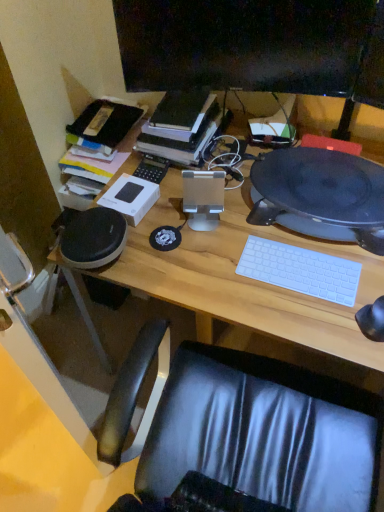
This screenshot has width=384, height=512. What do you see at coordinates (244, 44) in the screenshot?
I see `black glossy monitor at upper center` at bounding box center [244, 44].

The image size is (384, 512). What do you see at coordinates (320, 195) in the screenshot? I see `black matte speaker at right` at bounding box center [320, 195].

Where is `wooden desk at center`? wooden desk at center is located at coordinates pyautogui.click(x=244, y=279).

In order to click on hardcover book at center in this screenshot , I will do (x=181, y=126).

Which of these two, black matte speaker at right or hardcover book at center, is bigger?

Bigger between the two is black matte speaker at right.

Would you say black matte speaker at right contains hardcover book at center?

No, hardcover book at center is not a part of black matte speaker at right.

Which is in front, black matte speaker at right or hardcover book at center?

black matte speaker at right is in front.

From a real-world perspective, is black matte speaker at right located higher than hardcover book at center?

No, from a real-world perspective, black matte speaker at right is not above hardcover book at center.

In terms of width, does white matte keyboard at center look wider or thinner when compared to black glossy monitor at upper center?

white matte keyboard at center is wider than black glossy monitor at upper center.

Choose the correct answer: Is white matte keyboard at center inside black glossy monitor at upper center or outside it?

white matte keyboard at center is not enclosed by black glossy monitor at upper center.

Which is closer, [337,283] or [259,29]?

The point [337,283] is in front.

From their relative heights in the image, would you say white matte keyboard at center is taller or shorter than black glossy monitor at upper center?

Considering their sizes, white matte keyboard at center has less height than black glossy monitor at upper center.

Is hardcover book at center at the left side of white matte keyboard at center?

Correct, you'll find hardcover book at center to the left of white matte keyboard at center.

Considering the sizes of hardcover book at center and white matte keyboard at center in the image, is hardcover book at center bigger or smaller than white matte keyboard at center?

hardcover book at center is bigger than white matte keyboard at center.

Which object is closer to the camera taking this photo, hardcover book at center or white matte keyboard at center?

white matte keyboard at center is in front.

Is hardcover book at center facing towards white matte keyboard at center?

A: No.

Is black glossy monitor at upper center behind wooden desk at center?

Yes, it is behind wooden desk at center.

Based on the photo, from the image's perspective, relative to wooden desk at center, is black glossy monitor at upper center above or below?

Clearly, from the image's perspective, black glossy monitor at upper center is above wooden desk at center.

Is black glossy monitor at upper center facing towards wooden desk at center?

No, black glossy monitor at upper center is not aimed at wooden desk at center.

Considering the sizes of objects black glossy monitor at upper center and wooden desk at center in the image provided, who is bigger, black glossy monitor at upper center or wooden desk at center?

Bigger between the two is wooden desk at center.

Is hardcover book at center completely or partially outside of wooden desk at center?

Indeed, hardcover book at center is completely outside wooden desk at center.

Is point (169, 139) closer or farther from the camera than point (130, 275)?

Point (169, 139) appears to be farther away from the viewer than point (130, 275).

Is hardcover book at center facing towards wooden desk at center?

No, hardcover book at center is not facing towards wooden desk at center.

Between hardcover book at center and wooden desk at center, which one has more height?

With more height is wooden desk at center.

Consider the image. How many degrees apart are the facing directions of black matte speaker at right and black glossy monitor at upper center?

21.8 degrees.

Considering the sizes of black matte speaker at right and black glossy monitor at upper center in the image, is black matte speaker at right taller or shorter than black glossy monitor at upper center?

black matte speaker at right is shorter than black glossy monitor at upper center.

From the image's perspective, is black matte speaker at right located above black glossy monitor at upper center?

Incorrect, from the image's perspective, black matte speaker at right is lower than black glossy monitor at upper center.

Which of these two, black matte speaker at right or black glossy monitor at upper center, is wider?

black matte speaker at right is wider.

Is hardcover book at center positioned with its back to black matte speaker at right?

That's not correct — hardcover book at center is not looking away from black matte speaker at right.

Is hardcover book at center taller or shorter than black matte speaker at right?

Clearly, hardcover book at center is taller compared to black matte speaker at right.

Considering the sizes of hardcover book at center and black matte speaker at right in the image, is hardcover book at center bigger or smaller than black matte speaker at right?

Clearly, hardcover book at center is smaller in size than black matte speaker at right.

Is hardcover book at center not inside black matte speaker at right?

hardcover book at center is positioned outside black matte speaker at right.

Identify the location of book behind the black matte speaker at right. The width and height of the screenshot is (384, 512). (181, 126).

Where is `computer keyboard that appears on the right of black glossy monitor at upper center`? This screenshot has width=384, height=512. computer keyboard that appears on the right of black glossy monitor at upper center is located at coordinates (300, 270).

Looking at the image, which one is located further to wooden desk at center, black matte speaker at right or white matte keyboard at center?

black matte speaker at right is further to wooden desk at center.

Which object lies further to the anchor point white matte keyboard at center, hardcover book at center or wooden desk at center?

Among the two, hardcover book at center is located further to white matte keyboard at center.

When comparing their distances from black matte speaker at right, does wooden desk at center or hardcover book at center seem further?

Among the two, hardcover book at center is located further to black matte speaker at right.

Based on their spatial positions, is black glossy monitor at upper center or wooden desk at center closer to black matte speaker at right?

Based on the image, wooden desk at center appears to be nearer to black matte speaker at right.

Estimate the real-world distances between objects in this image. Which object is closer to wooden desk at center, hardcover book at center or black matte speaker at right?

Among the two, black matte speaker at right is located nearer to wooden desk at center.

Considering their positions, is black glossy monitor at upper center positioned closer to wooden desk at center than white matte keyboard at center?

white matte keyboard at center lies closer to wooden desk at center than the other object.

From the image, which object appears to be nearer to black glossy monitor at upper center, black matte speaker at right or wooden desk at center?

Among the two, black matte speaker at right is located nearer to black glossy monitor at upper center.

Considering their positions, is wooden desk at center positioned further to white matte keyboard at center than black glossy monitor at upper center?

black glossy monitor at upper center is positioned further to the anchor white matte keyboard at center.

At what (x,y) coordinates should I click in order to perform the action: click on computer between black glossy monitor at upper center and white matte keyboard at center vertically. Please return your answer as a coordinate pair (x, y). Image resolution: width=384 pixels, height=512 pixels. Looking at the image, I should click on (320, 195).

Identify the location of book that lies between black glossy monitor at upper center and black matte speaker at right from top to bottom. (181, 126).

Image resolution: width=384 pixels, height=512 pixels. Find the location of `computer keyboard between hardcover book at center and wooden desk at center in the up-down direction`. computer keyboard between hardcover book at center and wooden desk at center in the up-down direction is located at coordinates (300, 270).

Find the location of a particular element. computer between black glossy monitor at upper center and wooden desk at center in the vertical direction is located at coordinates (320, 195).